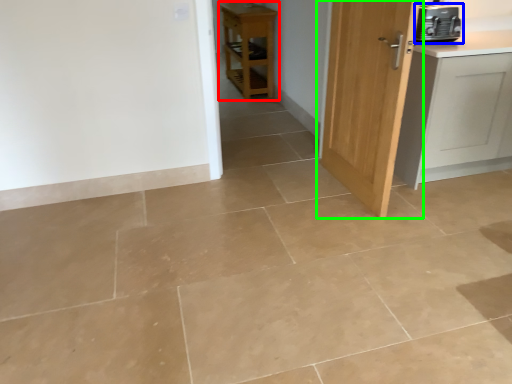
Question: Based on their relative distances, which object is nearer to furniture (highlighted by a red box)? Choose from home appliance (highlighted by a blue box) and door (highlighted by a green box).

Choices:
 (A) home appliance
 (B) door

Answer: (B)